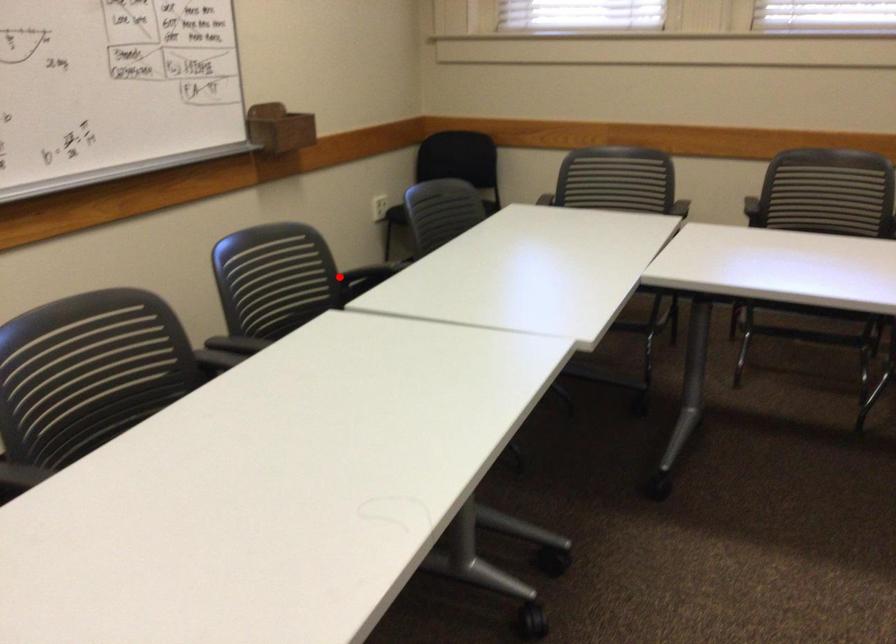
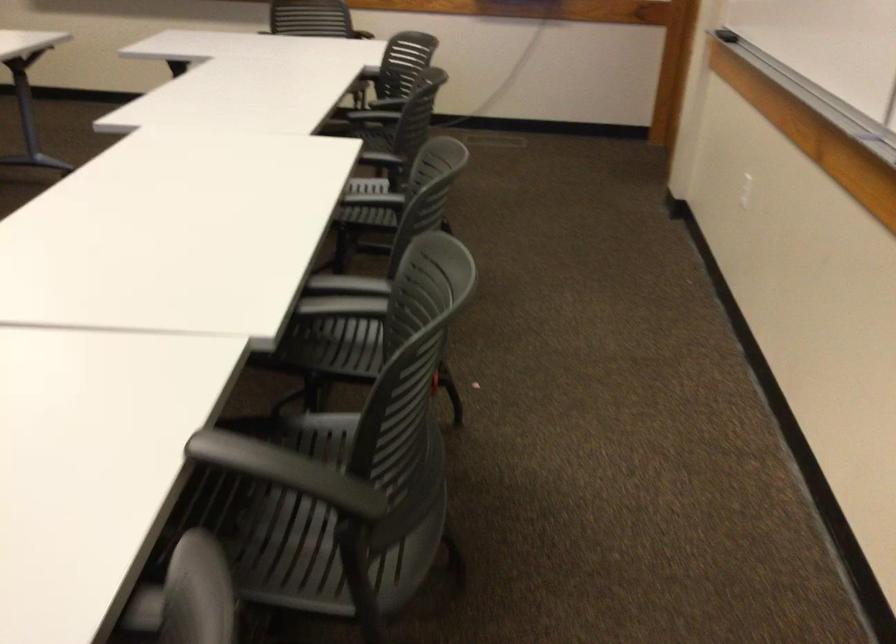
Question: I am providing you with two images of the same scene from different viewpoints. In image1, a red point is highlighted. Considering the same 3D point in image2, which of the following is correct?

Choices:
 (A) It is closer
 (B) It is farther

Answer: (A)